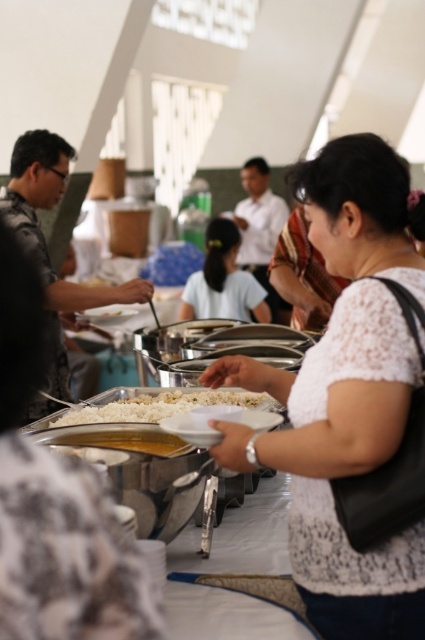
You are at a buffet and want to grab some food. You are standing at the entrance and see the white lace shirt at center and the white rice at center. Which item is closer to you?

The white rice at center is closer to you because the white lace shirt at center is 5.08 meters away from it, implying the shirt is farther away from the entrance compared to the rice.